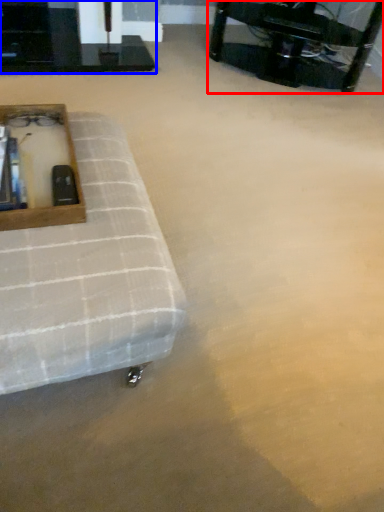
Question: Which object appears closest to the camera in this image, table (highlighted by a red box) or table (highlighted by a blue box)?

Choices:
 (A) table
 (B) table

Answer: (A)